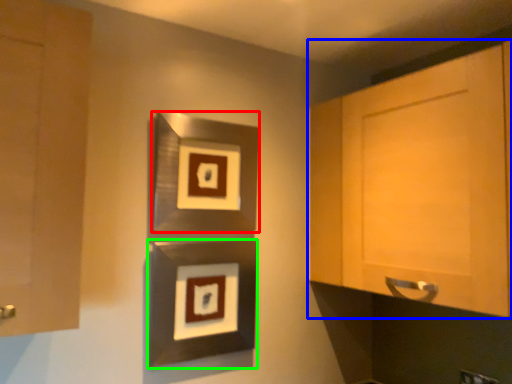
Question: Which object is the closest to the picture frame (highlighted by a red box)? Choose among these: cabinetry (highlighted by a blue box) or picture frame (highlighted by a green box).

Choices:
 (A) cabinetry
 (B) picture frame

Answer: (B)